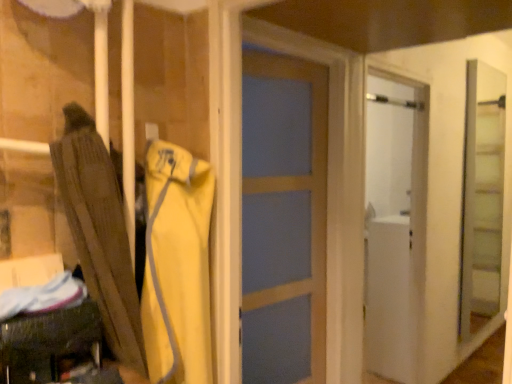
Question: Considering the positions of white matte refrigerator at right and yellow fabric jacket at center in the image, is white matte refrigerator at right wider or thinner than yellow fabric jacket at center?

Choices:
 (A) wide
 (B) thin

Answer: (A)

Question: Considering the positions of point (406, 284) and point (206, 306), is point (406, 284) closer or farther from the camera than point (206, 306)?

Choices:
 (A) closer
 (B) farther

Answer: (B)

Question: Which object is positioned closest to the yellow fabric jacket at center?

Choices:
 (A) brown fabric umbrella at left
 (B) white matte refrigerator at right
 (C) clear glass screen door at right

Answer: (A)

Question: Estimate the real-world distances between objects in this image. Which object is farther from the yellow fabric jacket at center?

Choices:
 (A) clear glass screen door at right
 (B) white matte refrigerator at right
 (C) brown fabric umbrella at left

Answer: (A)